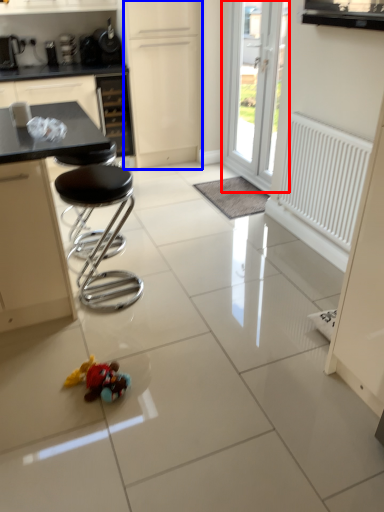
Question: Which of the following is the closest to the observer, door (highlighted by a red box) or screen door (highlighted by a blue box)?

Choices:
 (A) door
 (B) screen door

Answer: (A)